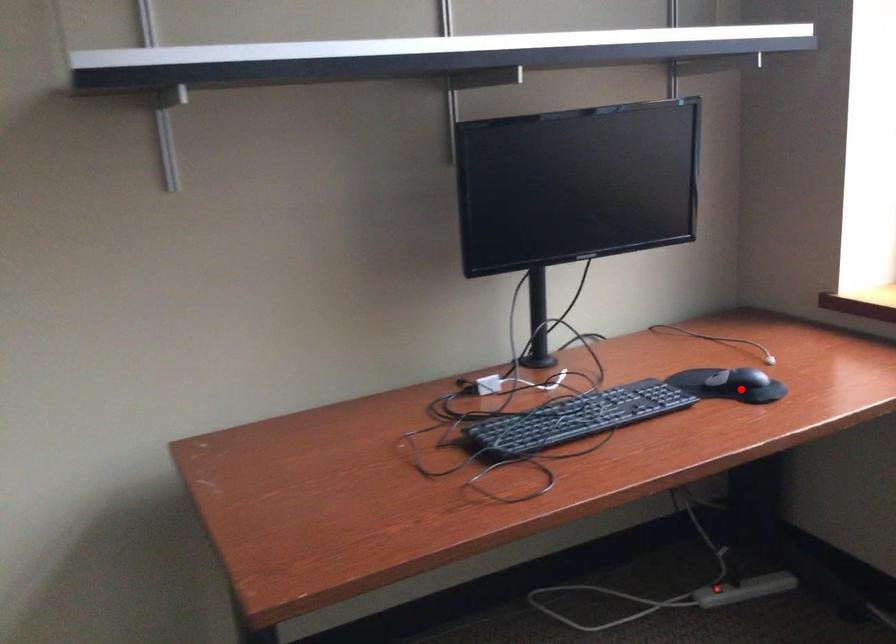
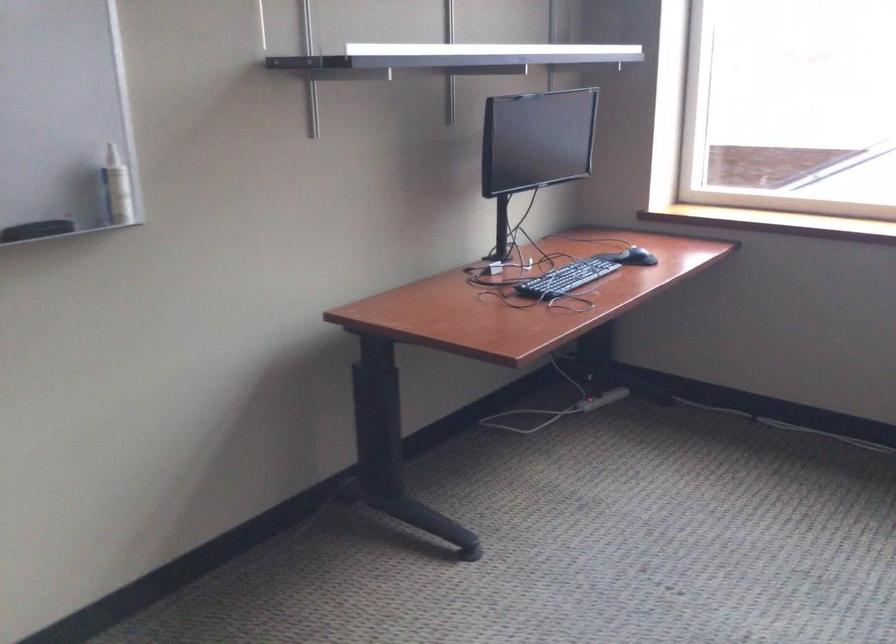
Question: I am providing you with two images of the same scene from different viewpoints. Given a red point in image1, look at the same physical point in image2. Is it:

Choices:
 (A) Closer to the viewpoint
 (B) Farther from the viewpoint

Answer: (B)